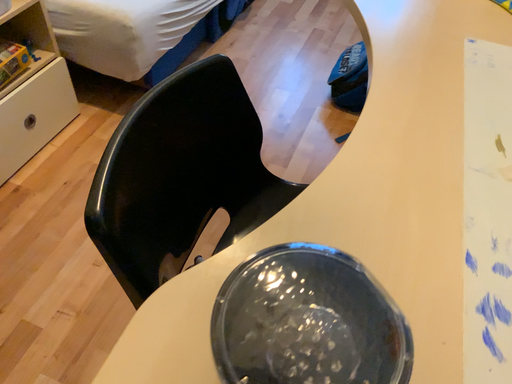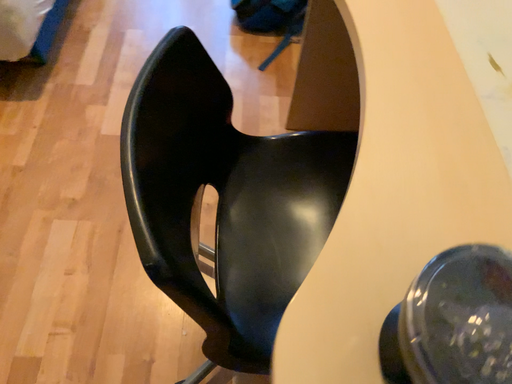
Question: Which way did the camera rotate in the video?

Choices:
 (A) rotated left
 (B) rotated right

Answer: (B)